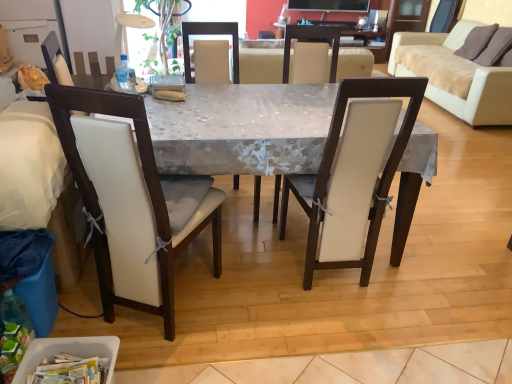
Locate an element on the screen. The image size is (512, 384). vacant area located to the right-hand side of white leather chair at center, placed as the first chair when sorted from right to left is located at coordinates (417, 282).